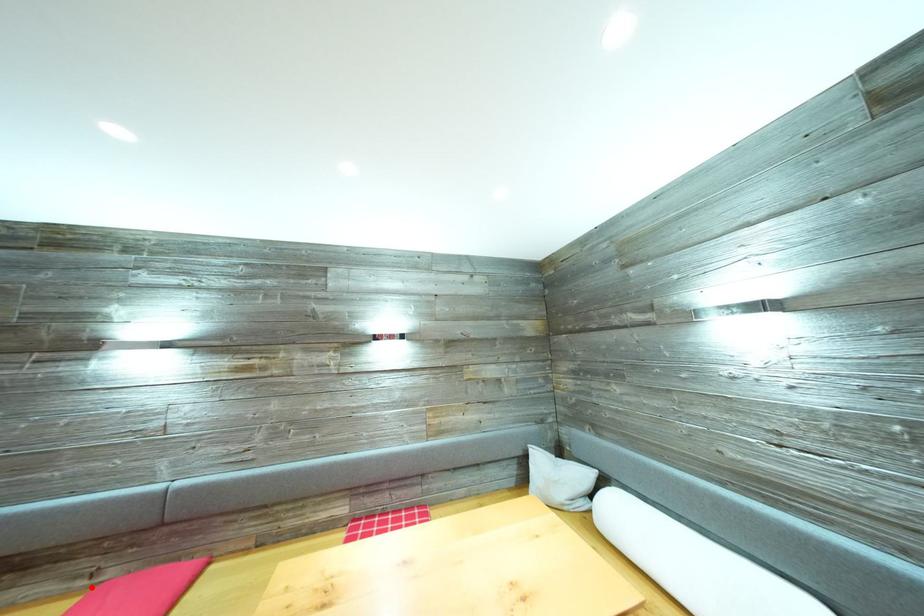
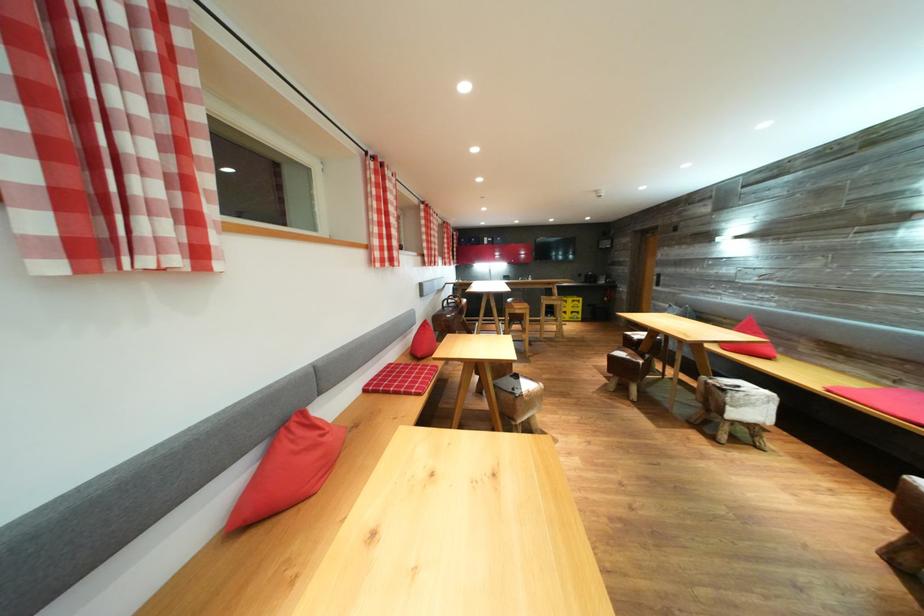
Question: I am providing you with two images of the same scene from different viewpoints. A red point is shown in image1. For the corresponding object point in image2, is it positioned nearer or farther from the camera?

Choices:
 (A) Nearer
 (B) Farther

Answer: (B)